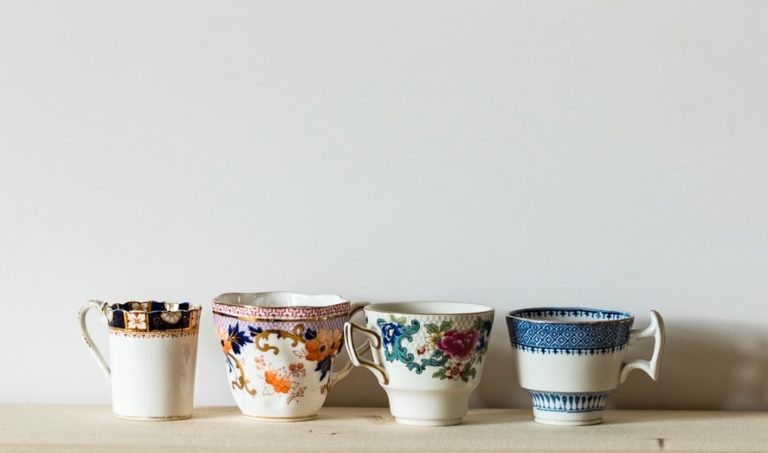
I want to click on handles, so click(88, 319), click(339, 372), click(373, 361), click(651, 351).